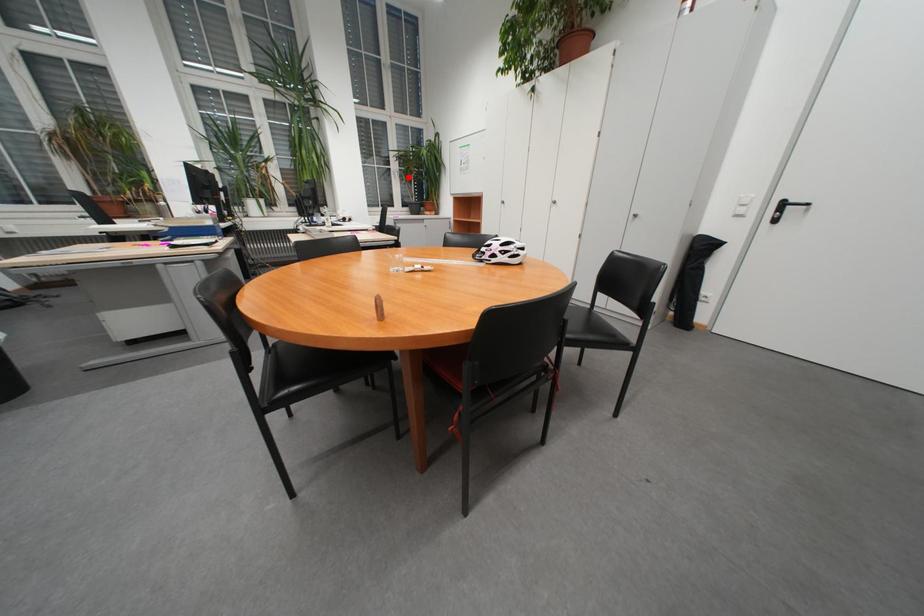
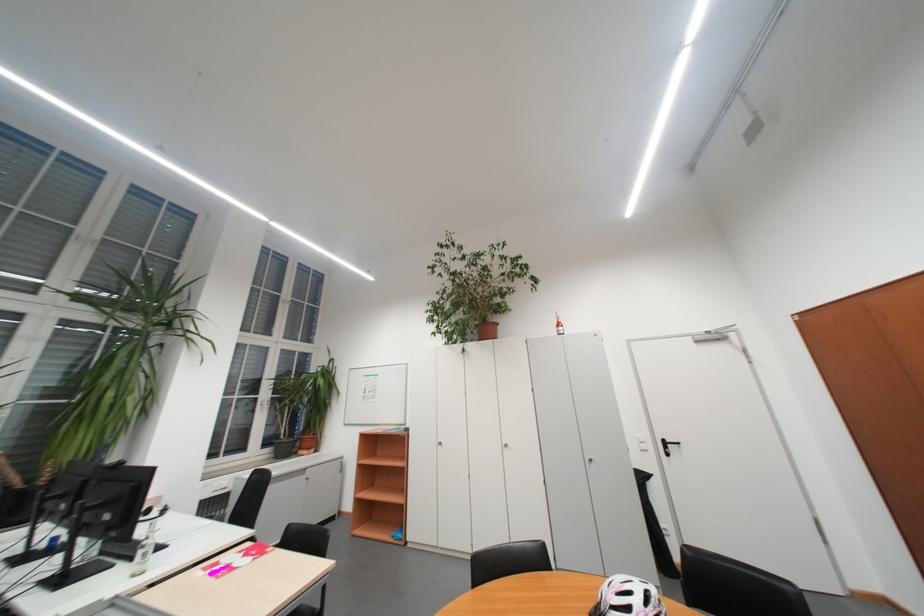
The point at the highlighted location is marked in the first image. Where is the corresponding point in the second image?

(277, 408)